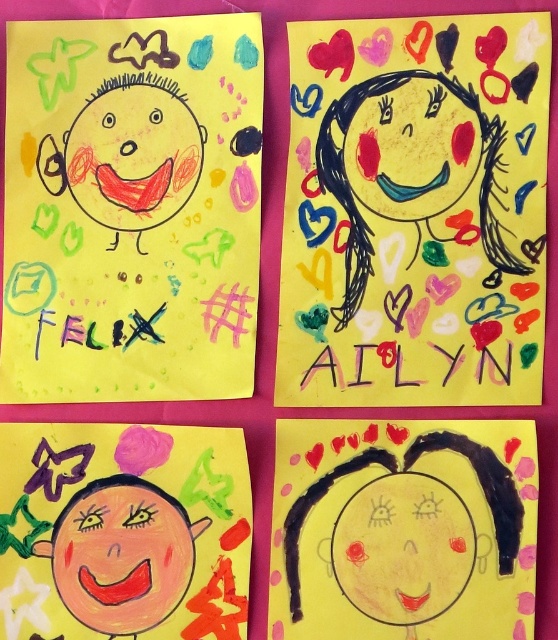
Is yellow matte face at center thinner than matte red face at upper left?

No, yellow matte face at center is not thinner than matte red face at upper left.

Does yellow matte face at center have a larger size compared to matte red face at upper left?

Correct, yellow matte face at center is larger in size than matte red face at upper left.

Between point (302, 627) and point (166, 128), which one is positioned in front?

Point (302, 627) is in front.

Image resolution: width=558 pixels, height=640 pixels. Identify the location of yellow matte face at center. 403,529.

Between smooth yellow face at center and black marker text at upper center, which one has more height?

With more height is smooth yellow face at center.

Which is behind, point (343, 579) or point (391, 365)?

Point (391, 365)

Image resolution: width=558 pixels, height=640 pixels. What are the coordinates of `smooth yellow face at center` in the screenshot? It's located at (403, 548).

Which is above, yellow matte face at center or smooth yellow face at upper center?

Positioned higher is smooth yellow face at upper center.

Can you confirm if yellow matte face at center is positioned to the left of smooth yellow face at upper center?

Indeed, yellow matte face at center is positioned on the left side of smooth yellow face at upper center.

Describe the element at coordinates (403, 529) in the screenshot. I see `yellow matte face at center` at that location.

Locate an element on the screen. The height and width of the screenshot is (640, 558). yellow matte face at center is located at coordinates (403, 529).